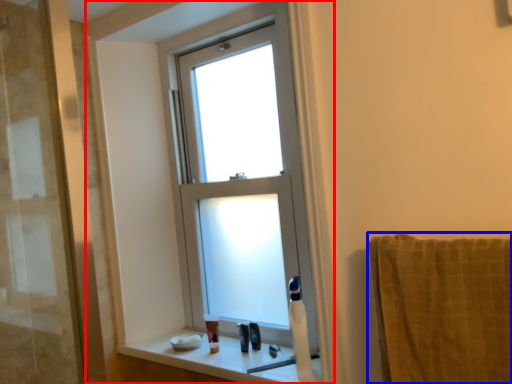
Question: Which point is further to the camera, window frame (highlighted by a red box) or towel/napkin (highlighted by a blue box)?

Choices:
 (A) window frame
 (B) towel/napkin

Answer: (A)